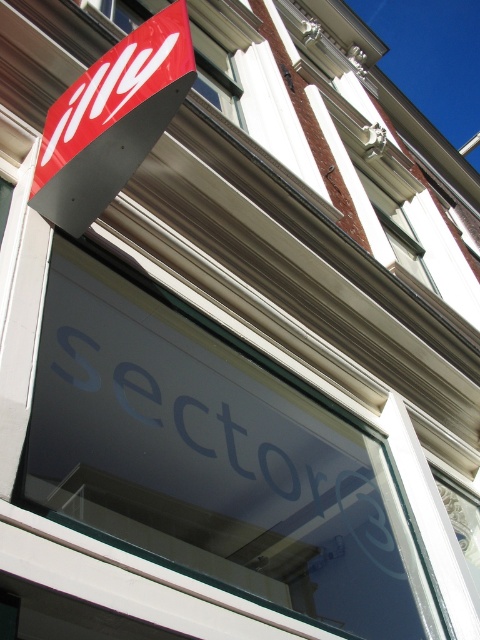
Question: Does matte red sign at upper left appear on the left side of red matte sign at upper left?

Choices:
 (A) no
 (B) yes

Answer: (B)

Question: Does matte red sign at upper left appear on the left side of red matte sign at upper left?

Choices:
 (A) no
 (B) yes

Answer: (B)

Question: Which point appears closest to the camera in this image?

Choices:
 (A) (202, 109)
 (B) (83, 220)

Answer: (B)

Question: Is matte red sign at upper left wider than red matte sign at upper left?

Choices:
 (A) yes
 (B) no

Answer: (B)